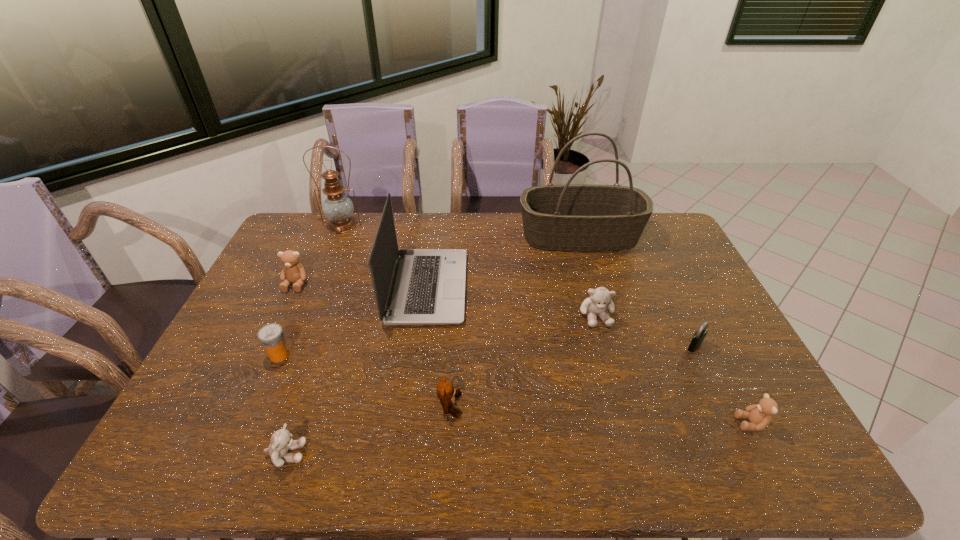
You are a GUI agent. You are given a task and a screenshot of the screen. Output one action in this format:
    pyautogui.click(x=<x>, y=<y>)
    Task: Click on the medicine at the left edge
    The image size is (960, 540).
    Given the screenshot: What is the action you would take?
    pyautogui.click(x=271, y=336)

You are a GUI agent. You are given a task and a screenshot of the screen. Output one action in this format:
    pyautogui.click(x=<x>, y=<y>)
    Task: Click on the basket present at the right edge
    The height and width of the screenshot is (540, 960).
    Given the screenshot: What is the action you would take?
    pyautogui.click(x=574, y=217)

Image resolution: width=960 pixels, height=540 pixels. Identify the location of padlock at the right edge. (699, 336).

What are the coordinates of `teddy bear that is at the right edge` in the screenshot? It's located at (759, 415).

At what (x,y) coordinates should I click in order to perform the action: click on object located in the far left corner section of the desktop. Please return your answer as a coordinate pair (x, y). This screenshot has height=540, width=960. Looking at the image, I should click on (338, 208).

This screenshot has height=540, width=960. In order to click on object that is at the far right corner in this screenshot , I will do `click(574, 217)`.

In the image, there is a desktop. In order to click on free space at the far edge in this screenshot , I will do `click(402, 235)`.

The width and height of the screenshot is (960, 540). What are the coordinates of `vacant point at the right edge` in the screenshot? It's located at (714, 306).

Identify the location of blank space at the far left corner of the desktop. pos(288,235).

Identify the location of vacant space at the near right corner of the desktop. The width and height of the screenshot is (960, 540). (738, 454).